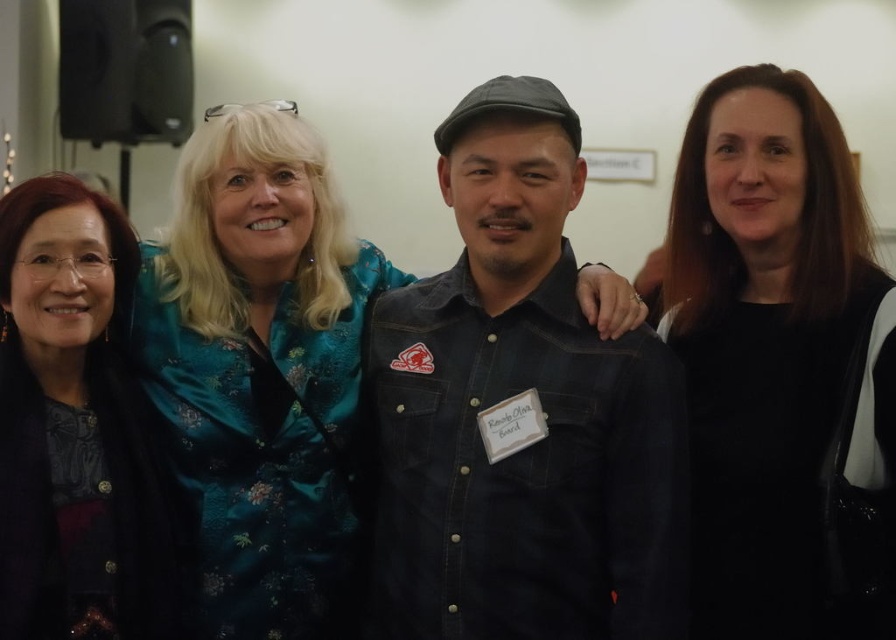
You are at a social event and see a woman wearing a black matte dress at center. If you want to approach her, which direction should you move relative to your current position facing the image?

The black matte dress at center is located at point coordinates 0.573 on the x axis and 0.874 on the y axis. Since the coordinates are relative to the image, moving towards the center area would require moving towards the middle of the image both horizontally and vertically. However, without knowing your exact starting position, the most precise direction would be to move towards the central region where the black matte dress at center is positioned.

In the scene shown: You are organizing a photo shoot and need to arrange two outfits from the image for a catalog. The denim shirt at center and the black matte dress at center must be displayed side by side. Which outfit should be placed lower to ensure proper visibility of both items?

The denim shirt at center should be placed lower because it has a lesser height compared to the black matte dress at center, ensuring both items are visible when displayed side by side.

You are a photographer at a social event and need to adjust the lighting to ensure both the black matte dress at center and the matte black jacket at left are visible. Since they are both black, how can you tell them apart based on their positions?

The black matte dress at center is positioned over the matte black jacket at left, so the dress is in front of the jacket. This difference in depth can help distinguish them through their spatial arrangement.